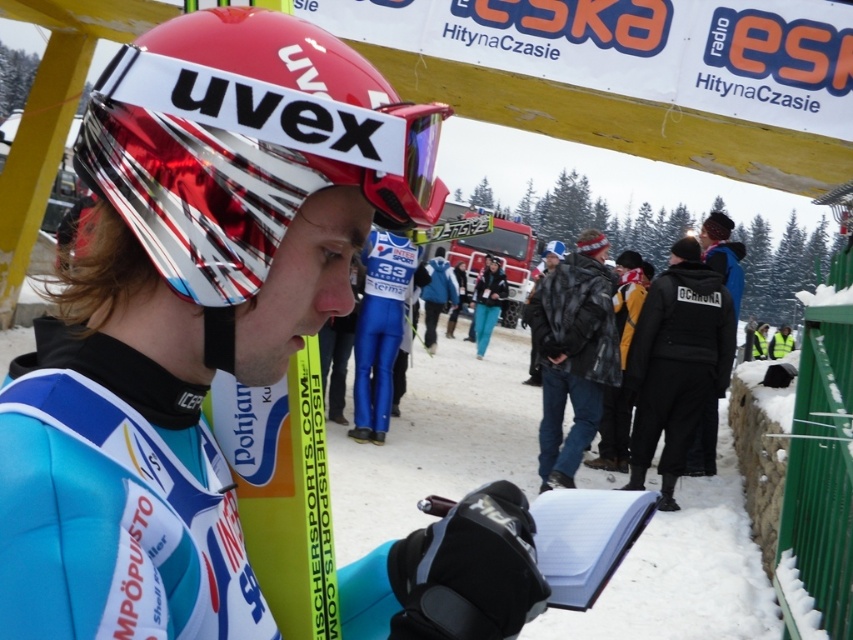
This screenshot has height=640, width=853. Describe the element at coordinates (573, 353) in the screenshot. I see `leather jacket at center` at that location.

Is point (543, 467) farther from camera compared to point (396, 225)?

That is True.

Where is `leather jacket at center`? leather jacket at center is located at coordinates (573, 353).

Looking at this image, does matte blue snowsuit at center appear on the left side of transparent plastic goggles at center?

Indeed, matte blue snowsuit at center is positioned on the left side of transparent plastic goggles at center.

Does matte blue snowsuit at center lie behind transparent plastic goggles at center?

No, matte blue snowsuit at center is closer to the viewer.

At what (x,y) coordinates should I click in order to perform the action: click on matte blue snowsuit at center. Please return your answer as a coordinate pair (x, y). The image size is (853, 640). Looking at the image, I should click on (181, 317).

Who is higher up, matte blue snowsuit at center or leather jacket at center?

matte blue snowsuit at center

Image resolution: width=853 pixels, height=640 pixels. Describe the element at coordinates (181, 317) in the screenshot. I see `matte blue snowsuit at center` at that location.

Between point (241, 134) and point (578, 346), which one is positioned in front?

Point (241, 134)

Find the location of a particular element. matte blue snowsuit at center is located at coordinates (181, 317).